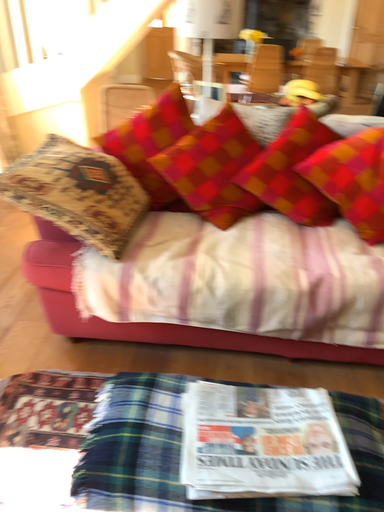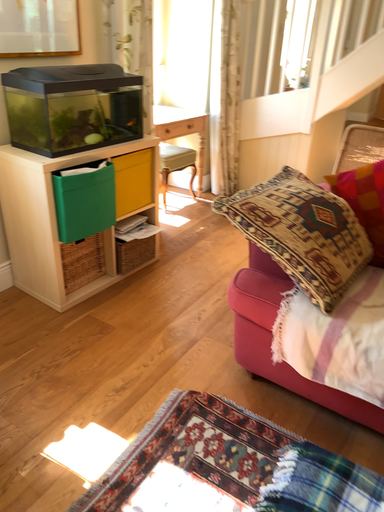
Question: Which way did the camera rotate in the video?

Choices:
 (A) rotated right
 (B) rotated left

Answer: (B)